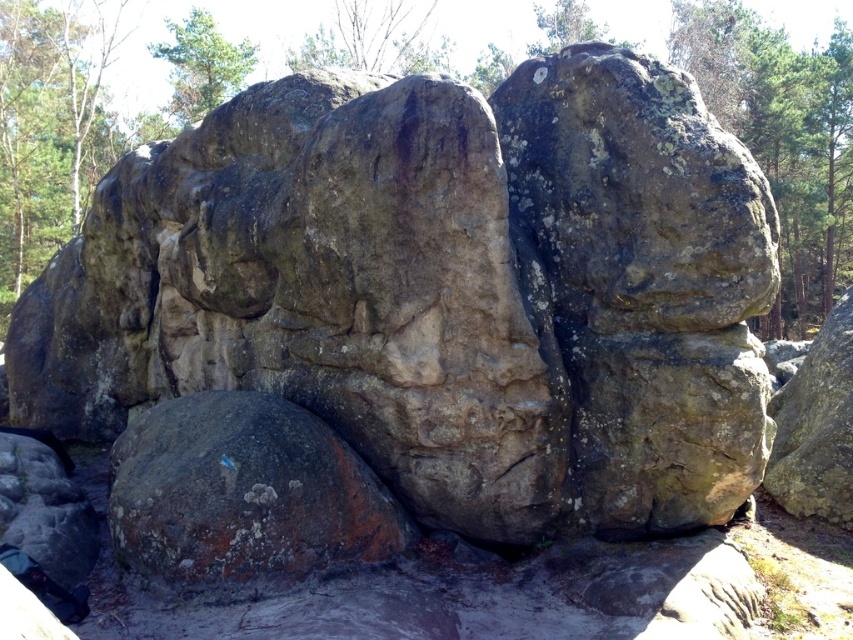
Question: Does green mossy rock at center have a greater width compared to green leafy tree at upper left?

Choices:
 (A) yes
 (B) no

Answer: (B)

Question: Can you confirm if green mossy rock at center is positioned above brown rough rock at center?

Choices:
 (A) yes
 (B) no

Answer: (A)

Question: Among these objects, which one is nearest to the camera?

Choices:
 (A) green mossy rock at center
 (B) green leafy tree at upper left
 (C) brown rough rock at right
 (D) brown rough rock at center

Answer: (D)

Question: Which object is farther from the camera taking this photo?

Choices:
 (A) brown rough rock at center
 (B) brown rough rock at right
 (C) green leafy tree at upper left

Answer: (C)

Question: Among these objects, which one is nearest to the camera?

Choices:
 (A) green mossy rock at center
 (B) brown rough rock at right

Answer: (A)

Question: Is green mossy rock at center to the right of brown rough rock at center from the viewer's perspective?

Choices:
 (A) no
 (B) yes

Answer: (B)